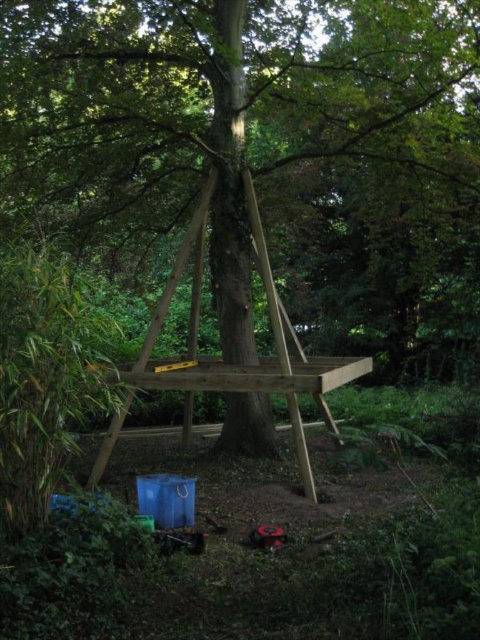
Question: Can you confirm if natural wood ladder at center is positioned above wooden picnic table at center?

Choices:
 (A) yes
 (B) no

Answer: (A)

Question: Which is nearer to the wooden picnic table at center?

Choices:
 (A) natural wood ladder at center
 (B) natural wood tree at center

Answer: (A)

Question: Does natural wood tree at center have a larger size compared to natural wood ladder at center?

Choices:
 (A) yes
 (B) no

Answer: (A)

Question: Which object is closer to the camera taking this photo?

Choices:
 (A) natural wood tree at center
 (B) natural wood ladder at center
 (C) wooden picnic table at center

Answer: (B)

Question: Does natural wood ladder at center have a larger size compared to wooden picnic table at center?

Choices:
 (A) no
 (B) yes

Answer: (B)

Question: Which of the following is the farthest from the observer?

Choices:
 (A) (468, 182)
 (B) (180, 385)
 (C) (290, 330)

Answer: (C)